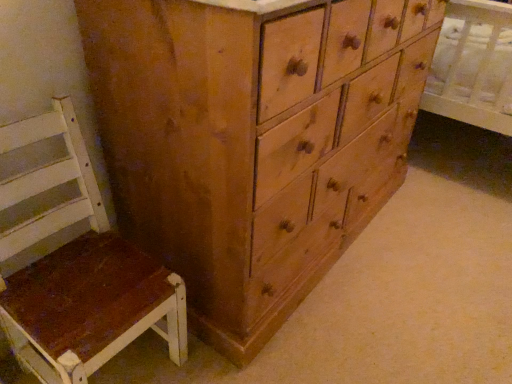
Question: From the image's perspective, is wooden chest of drawers at center located above or below white wood chair at left?

Choices:
 (A) below
 (B) above

Answer: (B)

Question: In the image, is wooden chest of drawers at center positioned in front of or behind white wood chair at left?

Choices:
 (A) front
 (B) behind

Answer: (B)

Question: From a real-world perspective, is wooden chest of drawers at center above or below white wood chair at left?

Choices:
 (A) above
 (B) below

Answer: (B)

Question: Relative to wooden chest of drawers at center, is white wood chair at left in front or behind?

Choices:
 (A) front
 (B) behind

Answer: (A)

Question: Is white wood chair at left spatially inside wooden chest of drawers at center, or outside of it?

Choices:
 (A) outside
 (B) inside

Answer: (A)

Question: Does point (78, 158) appear closer or farther from the camera than point (266, 127)?

Choices:
 (A) closer
 (B) farther

Answer: (B)

Question: From a real-world perspective, is white wood chair at left physically located above or below wooden chest of drawers at center?

Choices:
 (A) above
 (B) below

Answer: (A)